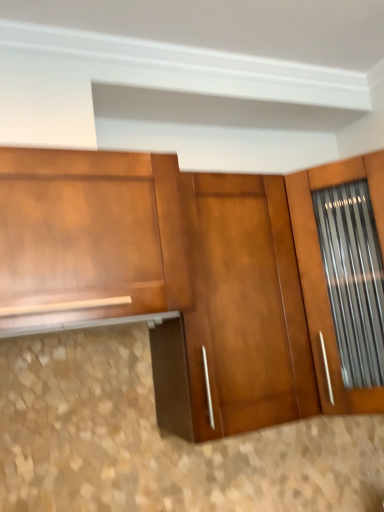
Question: Does point (51, 262) appear closer or farther from the camera than point (220, 395)?

Choices:
 (A) farther
 (B) closer

Answer: (B)

Question: In the image, is shiny brown cabinet at left on the left side or the right side of glossy wood door at center?

Choices:
 (A) left
 (B) right

Answer: (A)

Question: Would you say shiny brown cabinet at left is inside or outside glossy wood door at center?

Choices:
 (A) outside
 (B) inside

Answer: (A)

Question: Considering their positions, is glossy wood door at center located in front of or behind shiny brown cabinet at left?

Choices:
 (A) behind
 (B) front

Answer: (A)

Question: Is glossy wood door at center bigger or smaller than shiny brown cabinet at left?

Choices:
 (A) big
 (B) small

Answer: (A)

Question: Considering the positions of point (236, 330) and point (57, 267), is point (236, 330) closer or farther from the camera than point (57, 267)?

Choices:
 (A) farther
 (B) closer

Answer: (A)

Question: Considering the positions of glossy wood door at center and shiny brown cabinet at left in the image, is glossy wood door at center taller or shorter than shiny brown cabinet at left?

Choices:
 (A) tall
 (B) short

Answer: (A)